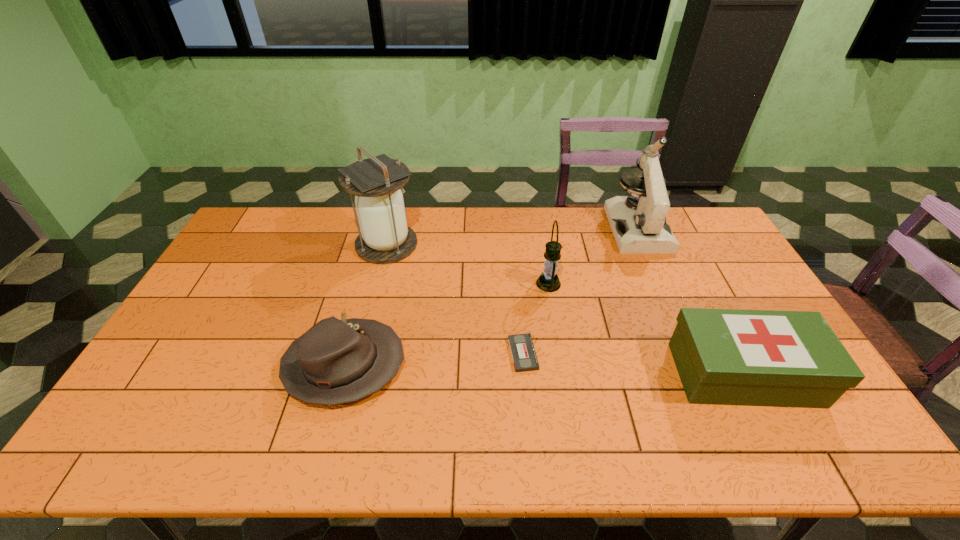
Identify the location of vacant space that satisfies the following two spatial constraints: 1. at the eyepiece of the microscope; 2. on the decorative side of the fifth tallest object. (697, 365).